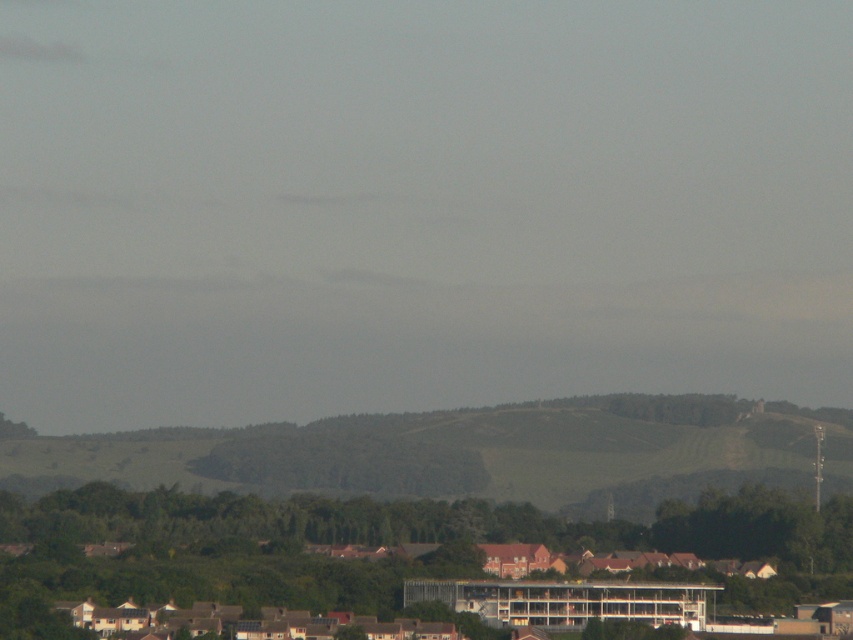
You are planning to plant a new tree in your backyard. You have two options based on the image you see. The first option is the green leafy tree at lower center, and the second is the green grassy hillside at center. Which option would require less space horizontally?

The green leafy tree at lower center has a lesser width compared to the green grassy hillside at center, so it requires less horizontal space.

You are standing in the landscape scene and notice the green leafy tree at lower center and the green grassy hillside at center. Which object is positioned to the right side from your viewpoint?

The green leafy tree at lower center is positioned to the right of the green grassy hillside at center.

Consider the image. You are standing in the foreground of the image where the buildings with red roofs are located. You want to walk to the green leafy tree at lower center marked by point (376,545). Which direction should you head?

The point (376,545) indicates the green leafy tree at lower center, so you should head towards the lower center direction to reach it.